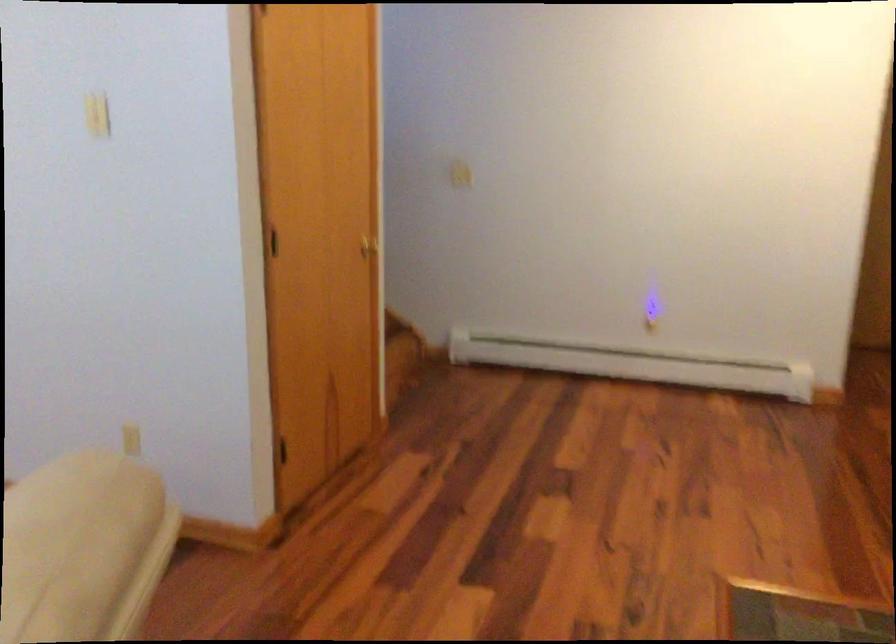
The image size is (896, 644). Describe the element at coordinates (367, 247) in the screenshot. I see `the small door knob` at that location.